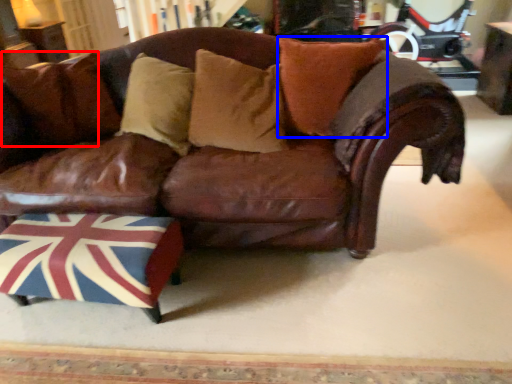
Question: Which object appears farthest to the camera in this image, pillow (highlighted by a red box) or pillow (highlighted by a blue box)?

Choices:
 (A) pillow
 (B) pillow

Answer: (A)